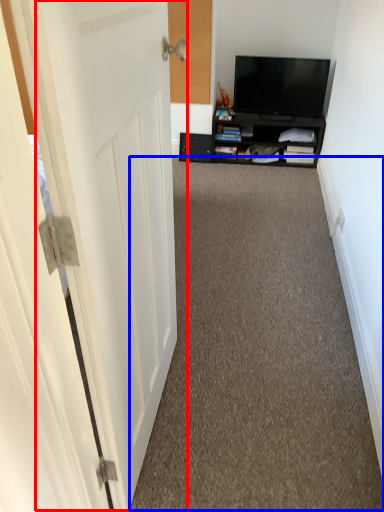
Question: Which of the following is the closest to the observer, door (highlighted by a red box) or corridor (highlighted by a blue box)?

Choices:
 (A) door
 (B) corridor

Answer: (A)